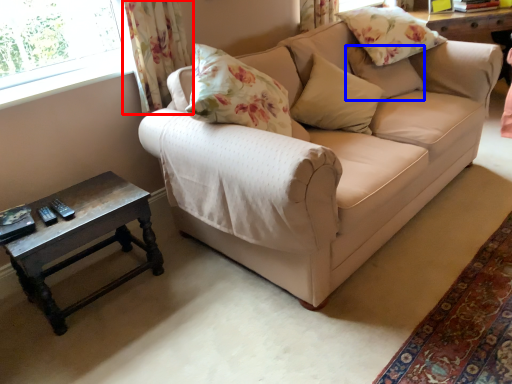
Question: Which point is closer to the camera, curtain (highlighted by a red box) or pillow (highlighted by a blue box)?

Choices:
 (A) curtain
 (B) pillow

Answer: (A)